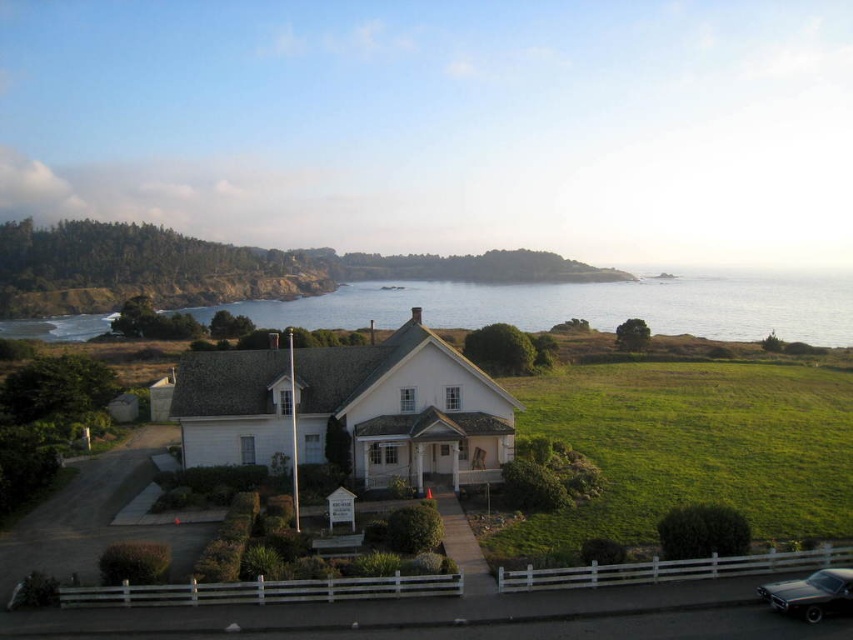
Does white wood fence at center lie behind blue water at center?

No, it is not.

Who is positioned more to the left, white wood fence at center or blue water at center?

white wood fence at center

Is point (647, 490) farther from viewer compared to point (30, 332)?

No, it is not.

I want to click on white wood fence at center, so click(x=693, y=448).

Consider the image. Does blue water at center come behind shiny black car at lower right?

Yes, blue water at center is behind shiny black car at lower right.

Can you confirm if blue water at center is taller than shiny black car at lower right?

Yes, blue water at center is taller than shiny black car at lower right.

You are a GUI agent. You are given a task and a screenshot of the screen. Output one action in this format:
    pyautogui.click(x=<x>, y=<y>)
    Task: Click on the blue water at center
    
    Given the screenshot: What is the action you would take?
    pyautogui.click(x=585, y=305)

Is white wood fence at center smaller than shiny black car at lower right?

Actually, white wood fence at center might be larger than shiny black car at lower right.

Image resolution: width=853 pixels, height=640 pixels. Identify the location of white wood fence at center. (693, 448).

Identify the location of white wood fence at center. Image resolution: width=853 pixels, height=640 pixels. (693, 448).